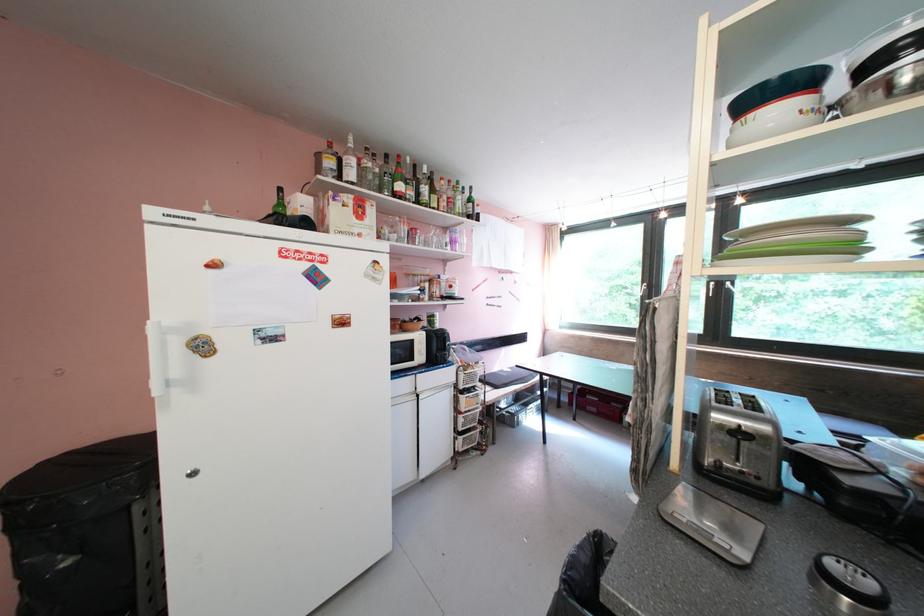
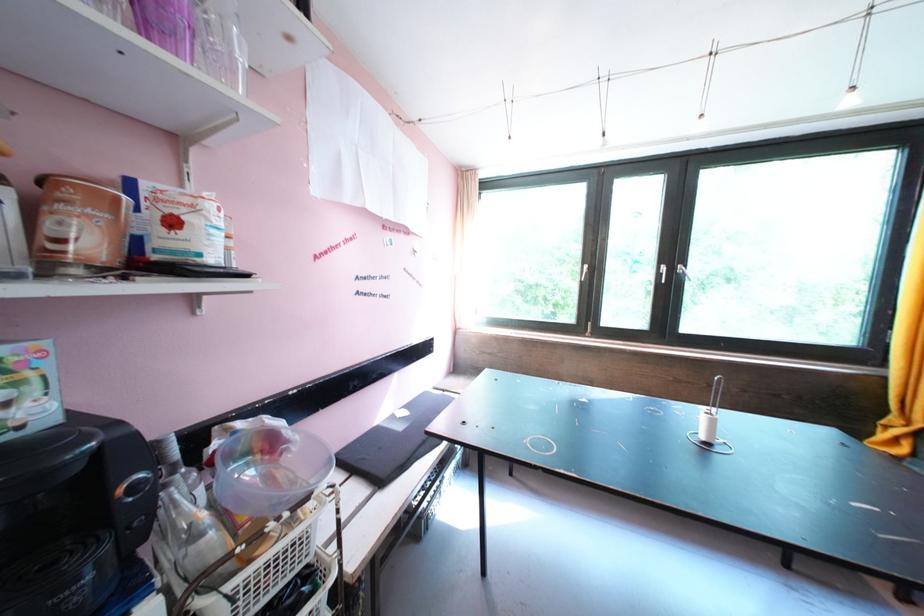
Question: The images are taken continuously from a first-person perspective. In which direction are you moving?

Choices:
 (A) Left
 (B) Right
 (C) Forward
 (D) Backward

Answer: (C)